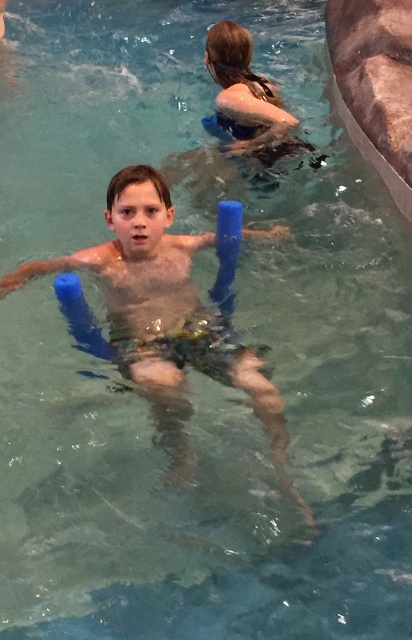
Question: Can you confirm if blue foam floaties at center is positioned to the left of blue rubber float at upper center?

Choices:
 (A) no
 (B) yes

Answer: (B)

Question: Which point is farther from the camera taking this photo?

Choices:
 (A) (121, 323)
 (B) (290, 144)

Answer: (B)

Question: In this image, where is blue foam floaties at center located relative to blue rubber float at upper center?

Choices:
 (A) above
 (B) below

Answer: (B)

Question: Where is blue foam floaties at center located in relation to blue rubber float at upper center in the image?

Choices:
 (A) right
 (B) left

Answer: (B)

Question: Among these objects, which one is nearest to the camera?

Choices:
 (A) blue rubber float at upper center
 (B) blue foam floaties at center

Answer: (B)